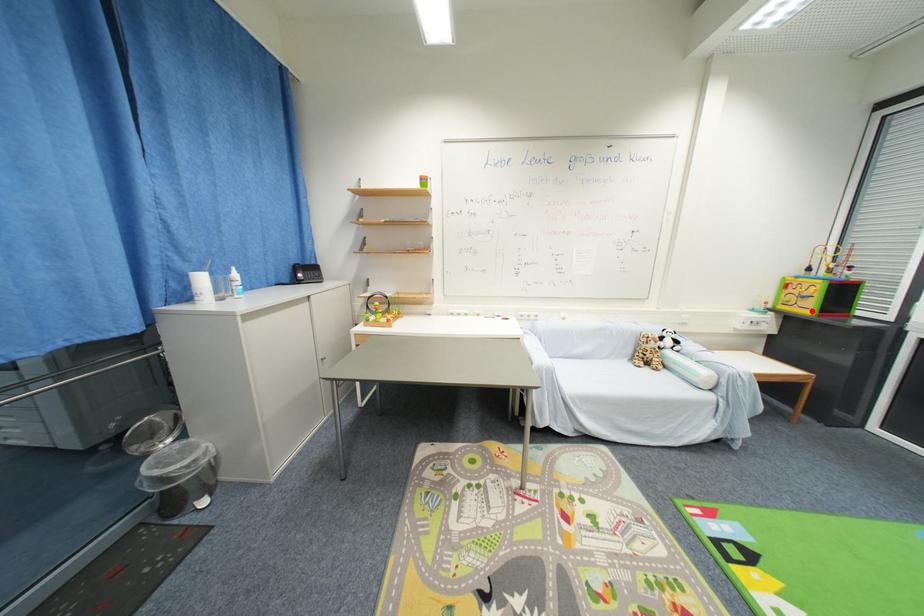
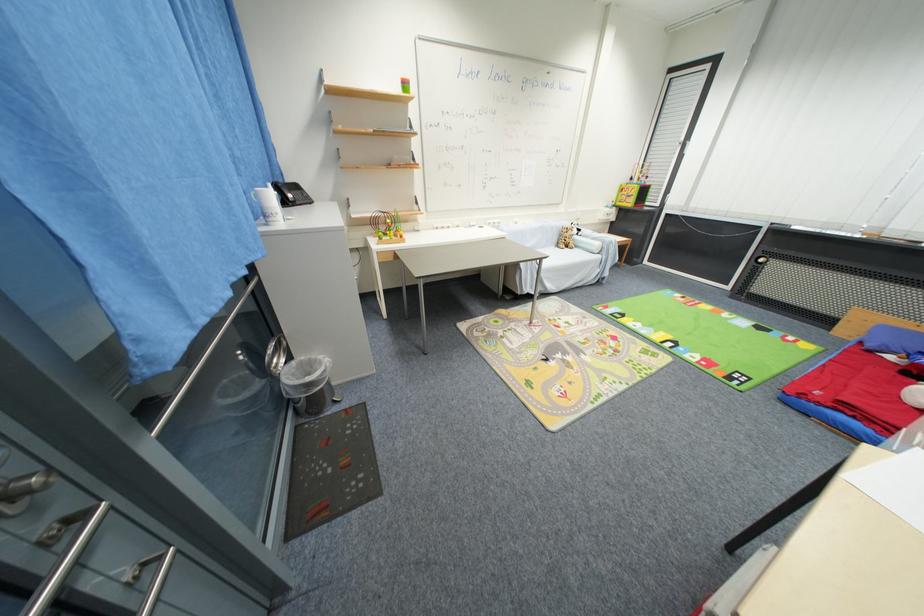
In the second image, find the point that corresponds to the highlighted location in the first image.

(635, 206)